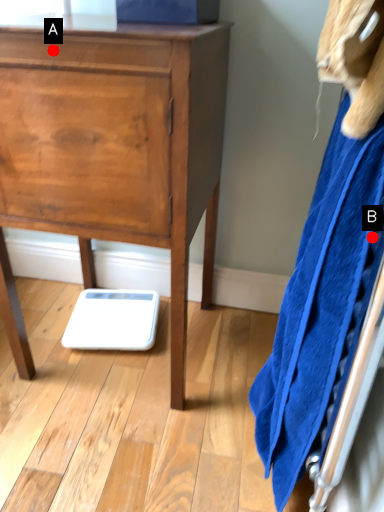
Question: Two points are circled on the image, labeled by A and B beside each circle. Among these points, which one is nearest to the camera?

Choices:
 (A) A is closer
 (B) B is closer

Answer: (B)